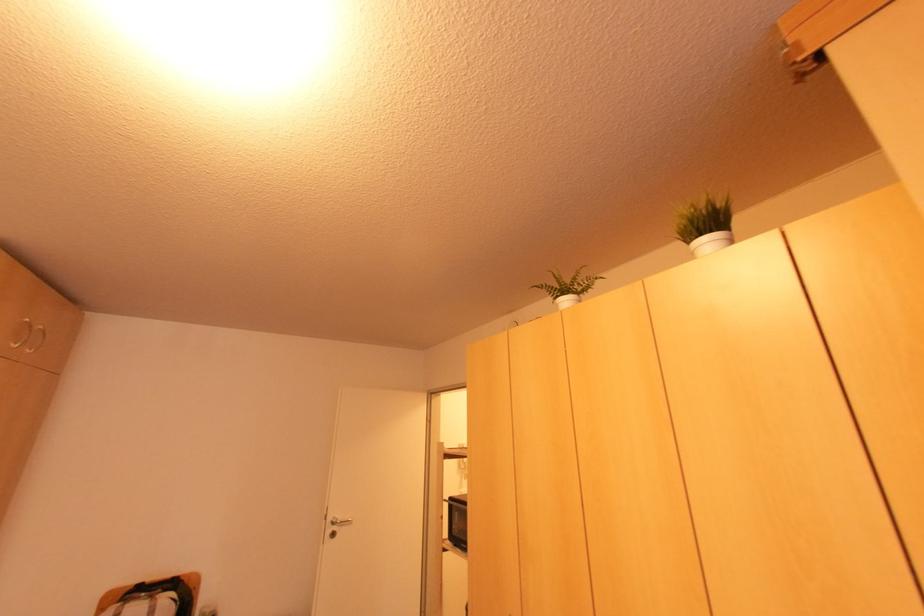
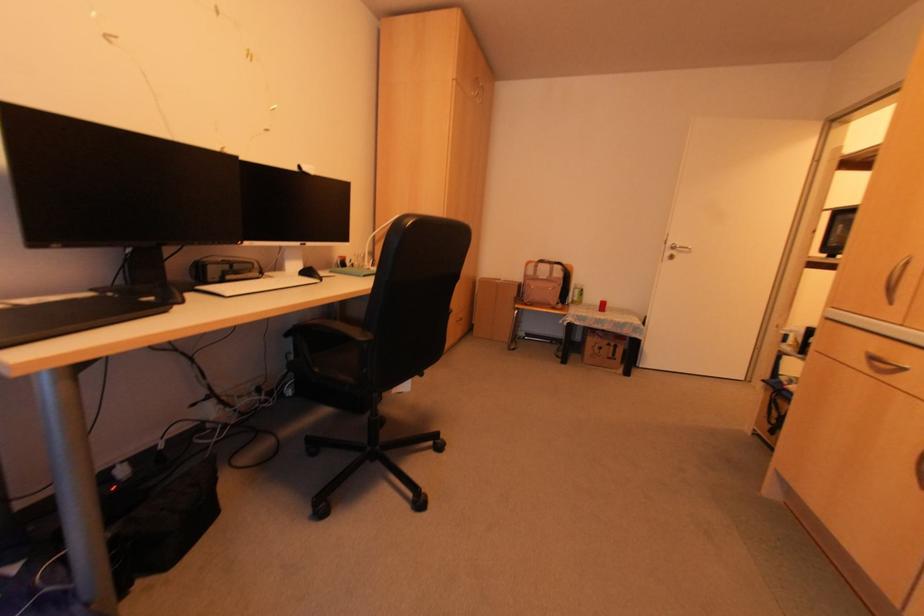
How did the camera likely rotate?

The camera's rotation is toward left-down.